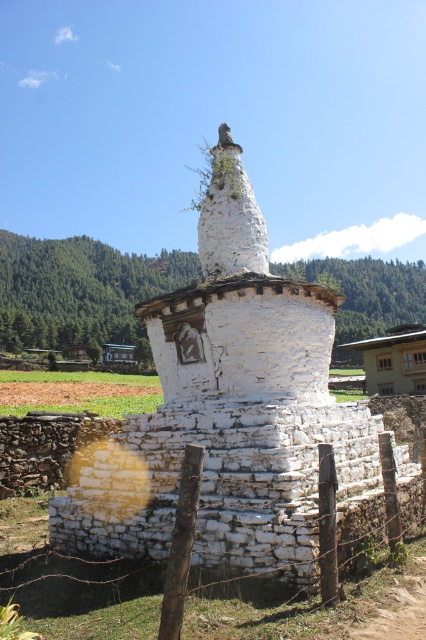
Does white stone stupa at center have a greater height compared to wooden hut at lower left?

Yes, white stone stupa at center is taller than wooden hut at lower left.

Is point (149, 301) positioned in front of point (115, 358)?

Yes.

Is point (201, 337) behind point (104, 353)?

No, (201, 337) is closer to viewer.

This screenshot has height=640, width=426. Identify the location of white stone stupa at center. (239, 307).

Looking at this image, is white stone stupa at center positioned behind wooden post at center?

Yes, white stone stupa at center is behind wooden post at center.

Between point (222, 241) and point (241, 588), which one is positioned in front?

Point (241, 588) is in front.

Locate an element on the screen. This screenshot has height=640, width=426. white stone stupa at center is located at coordinates (239, 307).

Who is taller, wooden post at center or brown wooden hut at right?

brown wooden hut at right

Does wooden post at center appear on the left side of brown wooden hut at right?

Indeed, wooden post at center is positioned on the left side of brown wooden hut at right.

Where is `wooden post at center`? The width and height of the screenshot is (426, 640). wooden post at center is located at coordinates (72, 580).

The width and height of the screenshot is (426, 640). Find the location of `wooden post at center`. wooden post at center is located at coordinates (72, 580).